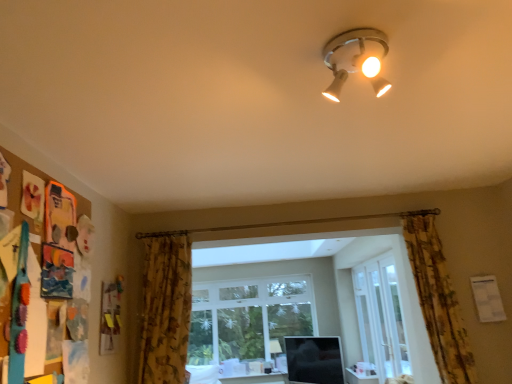
Where is `clear glass door at center`? Image resolution: width=512 pixels, height=384 pixels. clear glass door at center is located at coordinates tap(381, 317).

What is the approximate width of floral fabric curtain at lower left, which is the 1th curtain in left-to-right order?

The width of floral fabric curtain at lower left, which is the 1th curtain in left-to-right order, is 10.84 inches.

Measure the distance between floral fabric curtain at lower left, which is the 1th curtain in left-to-right order, and camera.

A distance of 8.77 feet exists between floral fabric curtain at lower left, which is the 1th curtain in left-to-right order, and camera.

The image size is (512, 384). What do you see at coordinates (257, 379) in the screenshot? I see `matte white table at lower center` at bounding box center [257, 379].

The width and height of the screenshot is (512, 384). I want to click on floral fabric curtain at right, arranged as the 1th curtain when viewed from the right, so click(437, 298).

The height and width of the screenshot is (384, 512). What are the coordinates of `clear glass window at center` in the screenshot? It's located at (248, 322).

Locate an element on the screen. The image size is (512, 384). white glossy screen door at center is located at coordinates (367, 323).

In order to click on matte white lamp at lower center, the first lamp when ordered from bottom to top in this screenshot , I will do `click(275, 349)`.

The height and width of the screenshot is (384, 512). Find the location of `clear glass door at center`. clear glass door at center is located at coordinates (381, 317).

Where is `window directly beneath the floral fabric curtain at lower left, which is the 1th curtain in left-to-right order (from a real-world perspective)`? window directly beneath the floral fabric curtain at lower left, which is the 1th curtain in left-to-right order (from a real-world perspective) is located at coordinates (248, 322).

Is point (260, 368) positioned in front of point (179, 234)?

No, it is behind (179, 234).

From the image's perspective, which one is positioned lower, clear glass window at center or floral fabric curtain at lower left, which is the 1th curtain in left-to-right order?

clear glass window at center is shown below in the image.

Can you confirm if clear glass window at center is smaller than floral fabric curtain at lower left, which appears as the second curtain when viewed from the right?

No.

Does floral fabric curtain at lower left, which is the 1th curtain in left-to-right order, have a greater width compared to white glossy screen door at center?

Yes, floral fabric curtain at lower left, which is the 1th curtain in left-to-right order, is wider than white glossy screen door at center.

Is white glossy screen door at center at the back of floral fabric curtain at lower left, which is the 1th curtain in left-to-right order?

No.

Based on their positions, is floral fabric curtain at lower left, which appears as the second curtain when viewed from the right, located to the left or right of white glossy screen door at center?

From the image, it's evident that floral fabric curtain at lower left, which appears as the second curtain when viewed from the right, is to the left of white glossy screen door at center.

From the picture: From the image's perspective, which is above, floral fabric curtain at lower left, which appears as the second curtain when viewed from the right, or white glossy screen door at center?

floral fabric curtain at lower left, which appears as the second curtain when viewed from the right, is shown above in the image.

Considering the sizes of objects matte white lamp at lower center, the second lamp viewed from the front, and clear glass window at center in the image provided, who is bigger, matte white lamp at lower center, the second lamp viewed from the front, or clear glass window at center?

With larger size is clear glass window at center.

Is matte white lamp at lower center, the first lamp when ordered from back to front, facing towards clear glass window at center?

No, matte white lamp at lower center, the first lamp when ordered from back to front, is not oriented towards clear glass window at center.

From the image's perspective, which is above, matte white lamp at lower center, the second lamp viewed from the front, or clear glass window at center?

From the image's view, clear glass window at center is above.

Do you think matte white lamp at lower center, the second lamp viewed from the top, is within clear glass window at center, or outside of it?

matte white lamp at lower center, the second lamp viewed from the top, is spatially situated outside clear glass window at center.

Can you confirm if white glossy screen door at center is shorter than matte white ceiling light at upper center, which appears as the 2th lamp when viewed from the back?

No, white glossy screen door at center is not shorter than matte white ceiling light at upper center, which appears as the 2th lamp when viewed from the back.

Is matte white ceiling light at upper center, which ranks as the second lamp in bottom-to-top order, completely or partially inside white glossy screen door at center?

No, matte white ceiling light at upper center, which ranks as the second lamp in bottom-to-top order, is not a part of white glossy screen door at center.

How distant is white glossy screen door at center from matte white ceiling light at upper center, the first lamp viewed from the front?

They are 14.46 feet apart.

Considering the sizes of objects white glossy screen door at center and matte white ceiling light at upper center, which appears as the 2th lamp when viewed from the back, in the image provided, who is bigger, white glossy screen door at center or matte white ceiling light at upper center, which appears as the 2th lamp when viewed from the back,?

Bigger between the two is white glossy screen door at center.

Considering the sizes of objects clear glass door at center and matte white table at lower center in the image provided, who is wider, clear glass door at center or matte white table at lower center?

Wider between the two is clear glass door at center.

Between clear glass door at center and matte white table at lower center, which one has smaller size?

matte white table at lower center.

Which is behind, point (386, 367) or point (277, 374)?

The point (277, 374) is more distant.

Looking at this image, how many degrees apart are the facing directions of clear glass door at center and matte white table at lower center?

They differ by 91.4 degrees in their facing directions.

Is matte white ceiling light at upper center, which ranks as the 1th lamp in top-to-bottom order, facing away from floral fabric curtain at right, which is the 2th curtain in left-to-right order?

matte white ceiling light at upper center, which ranks as the 1th lamp in top-to-bottom order, does not have its back to floral fabric curtain at right, which is the 2th curtain in left-to-right order.

From a real-world perspective, between matte white ceiling light at upper center, which appears as the 2th lamp when viewed from the back, and floral fabric curtain at right, arranged as the 1th curtain when viewed from the right, who is vertically lower?

floral fabric curtain at right, arranged as the 1th curtain when viewed from the right, from a real-world perspective.

Consider the image. Considering the sizes of matte white ceiling light at upper center, which appears as the 2th lamp when viewed from the back, and floral fabric curtain at right, which is the 2th curtain in left-to-right order, in the image, is matte white ceiling light at upper center, which appears as the 2th lamp when viewed from the back, wider or thinner than floral fabric curtain at right, which is the 2th curtain in left-to-right order,?

Considering their sizes, matte white ceiling light at upper center, which appears as the 2th lamp when viewed from the back, looks broader than floral fabric curtain at right, which is the 2th curtain in left-to-right order.

Is clear glass door at center at the back of floral fabric curtain at right, which is the 2th curtain in left-to-right order?

Yes, floral fabric curtain at right, which is the 2th curtain in left-to-right order, is facing away from clear glass door at center.

From a real-world perspective, which is physically below, floral fabric curtain at right, which is the 2th curtain in left-to-right order, or clear glass door at center?

clear glass door at center.

Is floral fabric curtain at right, arranged as the 1th curtain when viewed from the right, to the left or to the right of clear glass door at center in the image?

floral fabric curtain at right, arranged as the 1th curtain when viewed from the right, is to the left of clear glass door at center.

Where is `glass door behind the floral fabric curtain at right, which is the 2th curtain in left-to-right order`? The height and width of the screenshot is (384, 512). glass door behind the floral fabric curtain at right, which is the 2th curtain in left-to-right order is located at coordinates (381, 317).

Find the location of a particular element. This screenshot has width=512, height=384. curtain on the left side of clear glass window at center is located at coordinates (165, 307).

Identify the location of the 2nd curtain above the white glossy screen door at center (from a real-world perspective). (165, 307).

Considering their positions, is matte white table at lower center positioned closer to clear glass door at center than white glossy screen door at center?

The object closer to clear glass door at center is white glossy screen door at center.

Estimate the real-world distances between objects in this image. Which object is closer to matte white lamp at lower center, the first lamp when ordered from back to front, matte white table at lower center or floral fabric curtain at right, arranged as the 1th curtain when viewed from the right?

matte white table at lower center is closer to matte white lamp at lower center, the first lamp when ordered from back to front.

Estimate the real-world distances between objects in this image. Which object is closer to floral fabric curtain at lower left, which is the 1th curtain in left-to-right order, clear glass window at center or floral fabric curtain at right, arranged as the 1th curtain when viewed from the right?

The object closer to floral fabric curtain at lower left, which is the 1th curtain in left-to-right order, is floral fabric curtain at right, arranged as the 1th curtain when viewed from the right.

Based on their spatial positions, is floral fabric curtain at lower left, which is the 1th curtain in left-to-right order, or clear glass window at center further from white glossy screen door at center?

floral fabric curtain at lower left, which is the 1th curtain in left-to-right order, lies further to white glossy screen door at center than the other object.

Looking at the image, which one is located further to floral fabric curtain at right, arranged as the 1th curtain when viewed from the right, clear glass window at center or white glossy screen door at center?

clear glass window at center lies further to floral fabric curtain at right, arranged as the 1th curtain when viewed from the right, than the other object.

When comparing their distances from matte white ceiling light at upper center, which ranks as the second lamp in bottom-to-top order, does clear glass window at center or floral fabric curtain at lower left, which is the 1th curtain in left-to-right order, seem closer?

The object closer to matte white ceiling light at upper center, which ranks as the second lamp in bottom-to-top order, is floral fabric curtain at lower left, which is the 1th curtain in left-to-right order.

Estimate the real-world distances between objects in this image. Which object is closer to matte white lamp at lower center, the first lamp when ordered from bottom to top, clear glass window at center or matte white ceiling light at upper center, which ranks as the second lamp in bottom-to-top order?

clear glass window at center lies closer to matte white lamp at lower center, the first lamp when ordered from bottom to top, than the other object.

Estimate the real-world distances between objects in this image. Which object is closer to matte white lamp at lower center, the first lamp when ordered from bottom to top, clear glass door at center or clear glass window at center?

clear glass window at center is positioned closer to the anchor matte white lamp at lower center, the first lamp when ordered from bottom to top.

Find the location of a particular element. This screenshot has height=384, width=512. glass door between matte white ceiling light at upper center, which ranks as the 1th lamp in top-to-bottom order, and clear glass window at center from front to back is located at coordinates (381, 317).

Where is `table located between floral fabric curtain at lower left, which is the 1th curtain in left-to-right order, and clear glass window at center in the depth direction`? Image resolution: width=512 pixels, height=384 pixels. table located between floral fabric curtain at lower left, which is the 1th curtain in left-to-right order, and clear glass window at center in the depth direction is located at coordinates (257, 379).

Identify the location of table located between floral fabric curtain at right, arranged as the 1th curtain when viewed from the right, and clear glass window at center in the depth direction. (257, 379).

Where is `table between clear glass door at center and matte white lamp at lower center, the first lamp when ordered from bottom to top, along the z-axis`? The image size is (512, 384). table between clear glass door at center and matte white lamp at lower center, the first lamp when ordered from bottom to top, along the z-axis is located at coordinates (257, 379).